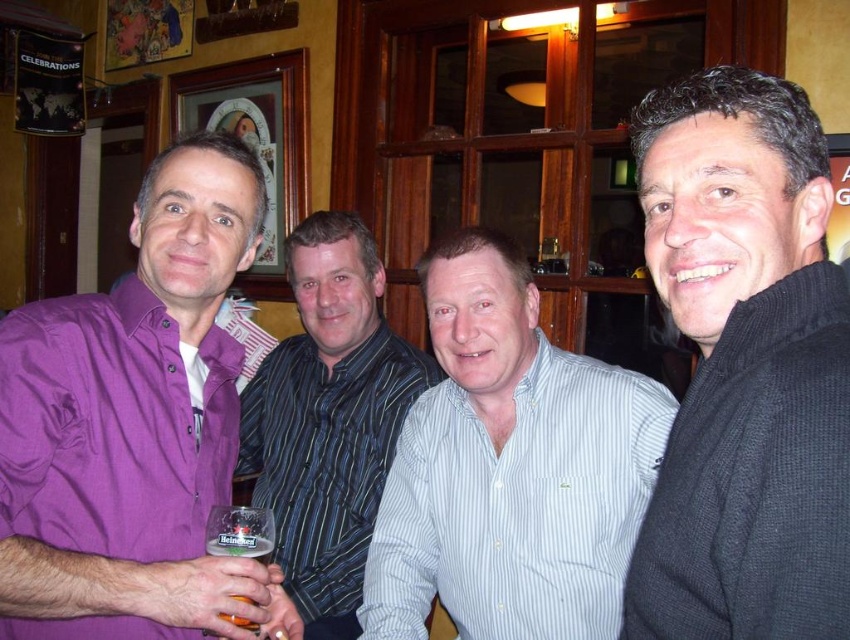
Question: Which object appears closest to the camera in this image?

Choices:
 (A) translucent plastic beer glass at lower left
 (B) purple cotton shirt at left

Answer: (B)

Question: Does purple cotton shirt at left lie behind striped shirt at center?

Choices:
 (A) no
 (B) yes

Answer: (A)

Question: Among these objects, which one is nearest to the camera?

Choices:
 (A) translucent plastic beer glass at lower left
 (B) striped shirt at center
 (C) black wool sweater at right

Answer: (C)

Question: Does purple cotton shirt at left appear under striped shirt at center?

Choices:
 (A) yes
 (B) no

Answer: (B)

Question: Which of the following is the closest to the observer?

Choices:
 (A) translucent plastic beer glass at lower left
 (B) striped shirt at center
 (C) purple cotton shirt at left
 (D) light blue striped shirt at center

Answer: (C)

Question: Does purple cotton shirt at left lie in front of striped shirt at center?

Choices:
 (A) yes
 (B) no

Answer: (A)